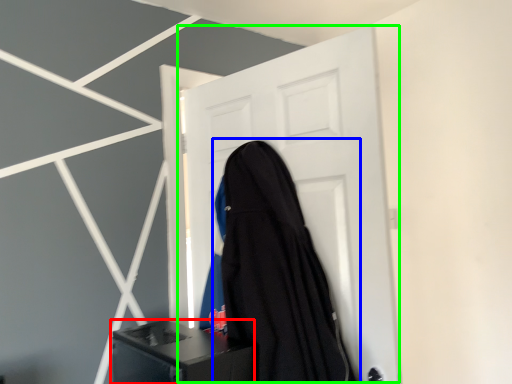
Question: Which object is positioned closest to furniture (highlighted by a red box)? Select from garment (highlighted by a blue box) and door (highlighted by a green box).

Choices:
 (A) garment
 (B) door

Answer: (A)